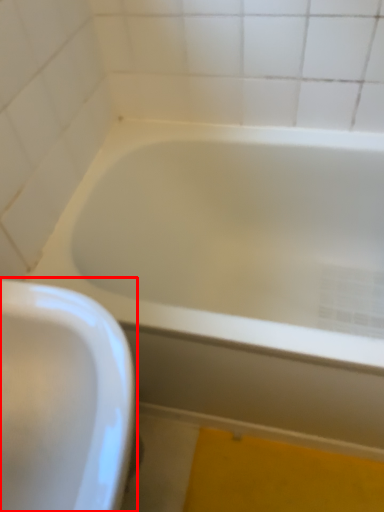
Question: From the image's perspective, where is sink (annotated by the red box) located in relation to bathtub in the image?

Choices:
 (A) above
 (B) below

Answer: (B)